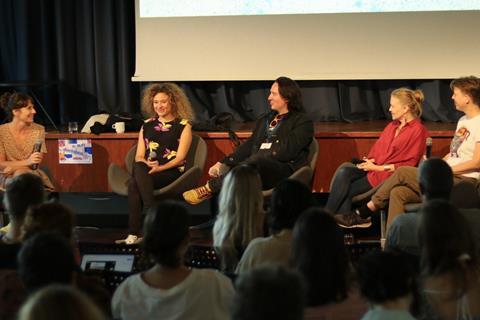
Where is `stage`? stage is located at coordinates (327, 153).